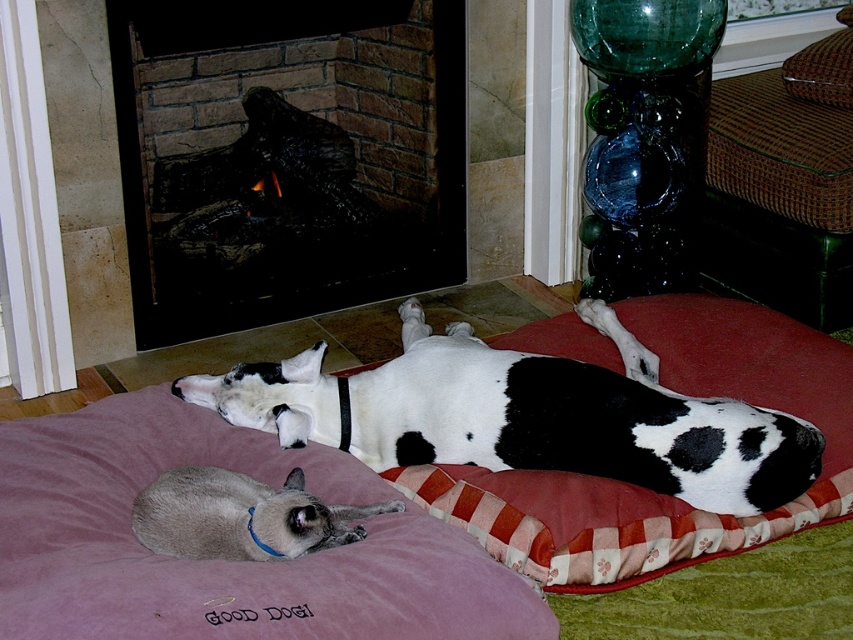
Question: Does velvet purple cat bed at lower left have a lesser width compared to silky gray cat at lower left?

Choices:
 (A) yes
 (B) no

Answer: (B)

Question: Estimate the real-world distances between objects in this image. Which object is farther from the velvet purple cat bed at lower left?

Choices:
 (A) silky gray cat at lower left
 (B) black and white fur at center
 (C) brick fireplace at upper left
 (D) purple suede dog bed at center

Answer: (C)

Question: Can you confirm if purple suede dog bed at center is smaller than velvet purple cat bed at lower left?

Choices:
 (A) yes
 (B) no

Answer: (B)

Question: Which of the following is the closest to the observer?

Choices:
 (A) (x=265, y=548)
 (B) (x=129, y=419)
 (C) (x=563, y=436)
 (D) (x=463, y=612)

Answer: (D)

Question: Which object appears closest to the camera in this image?

Choices:
 (A) velvet purple cat bed at lower left
 (B) brick fireplace at upper left

Answer: (A)

Question: From the image, what is the correct spatial relationship of brick fireplace at upper left in relation to black and white fur at center?

Choices:
 (A) left
 (B) right

Answer: (A)